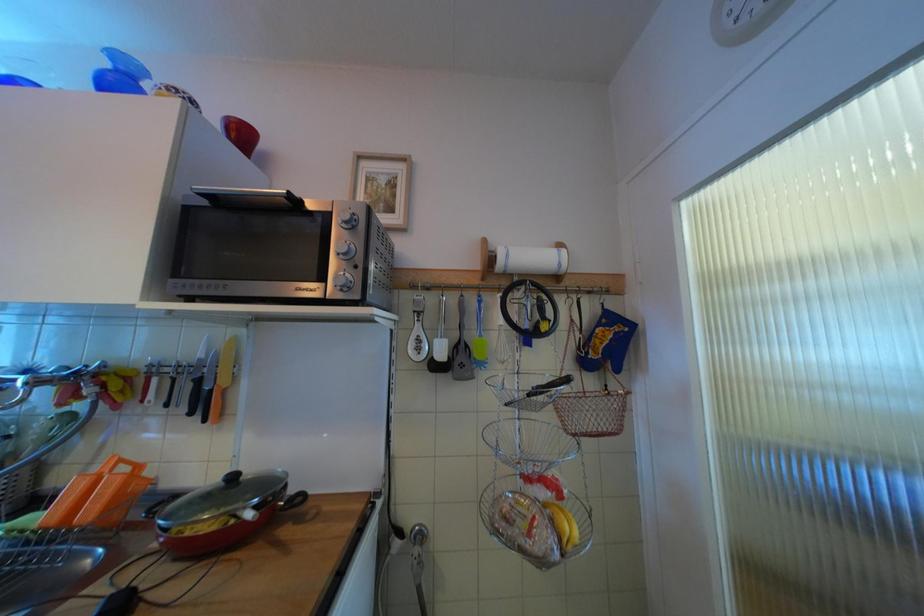
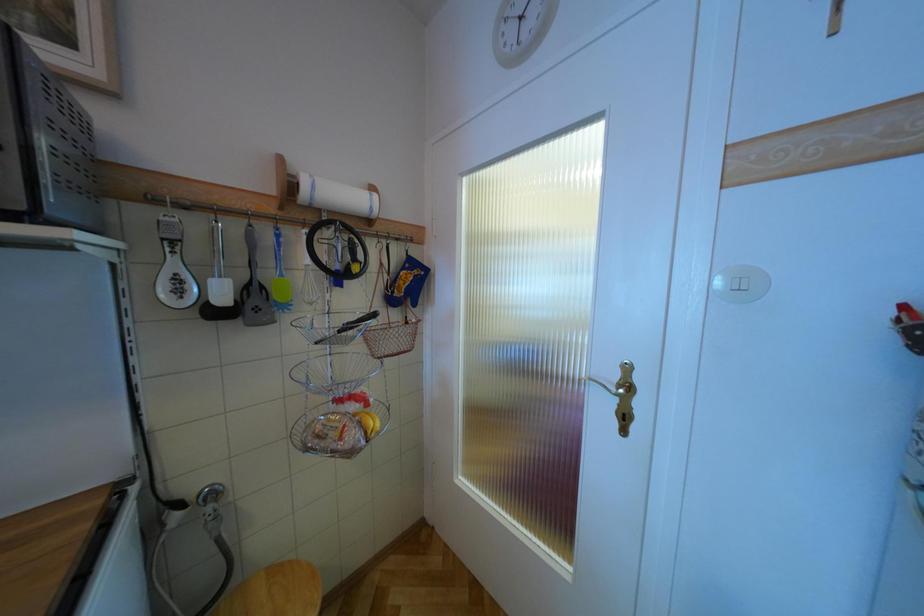
Question: How did the camera likely rotate?

Choices:
 (A) Left
 (B) Right
 (C) Up
 (D) Down

Answer: (B)